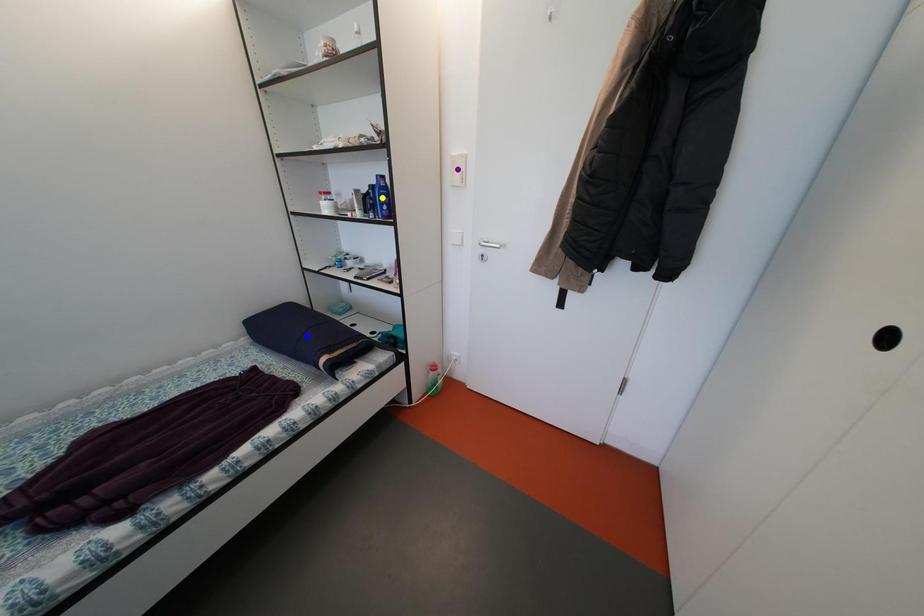
Order these from nearest to farthest:
A) yellow point
B) purple point
C) blue point

yellow point < purple point < blue point